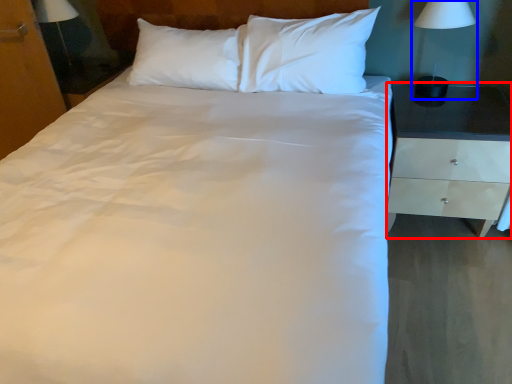
Question: Which of the following is the farthest to the observer, nightstand (highlighted by a red box) or bedside lamp (highlighted by a blue box)?

Choices:
 (A) nightstand
 (B) bedside lamp

Answer: (B)